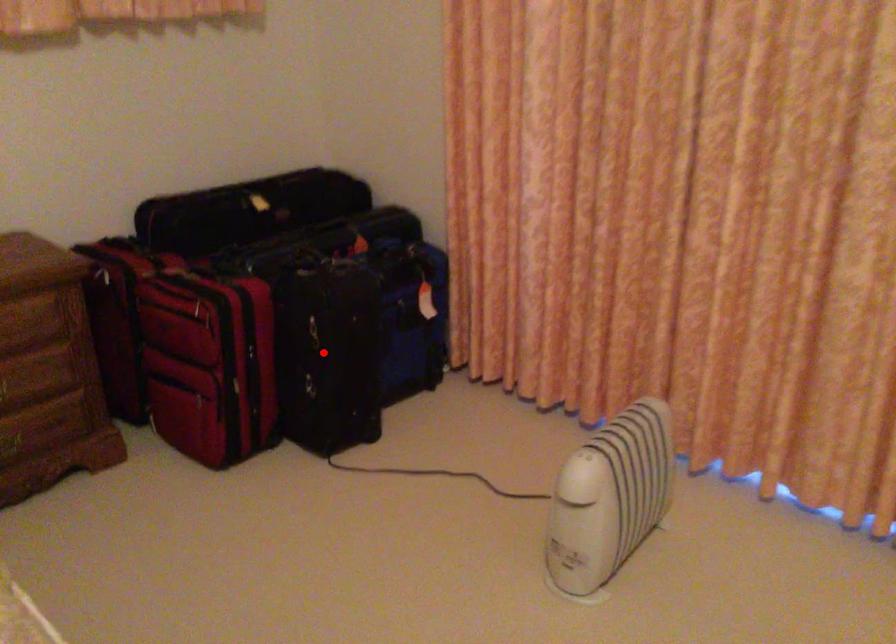
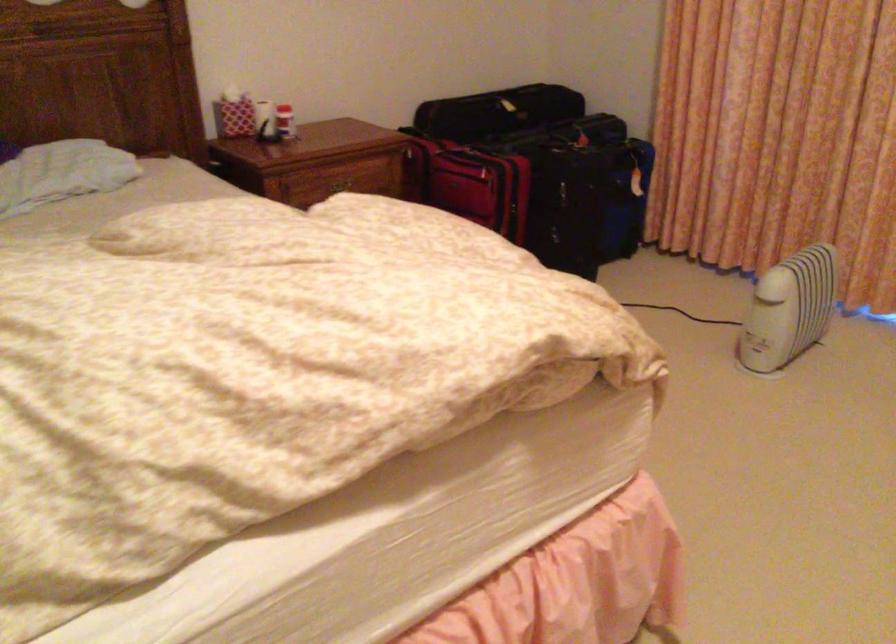
Where in the second image is the point corresponding to the highlighted location from the first image?

(566, 205)